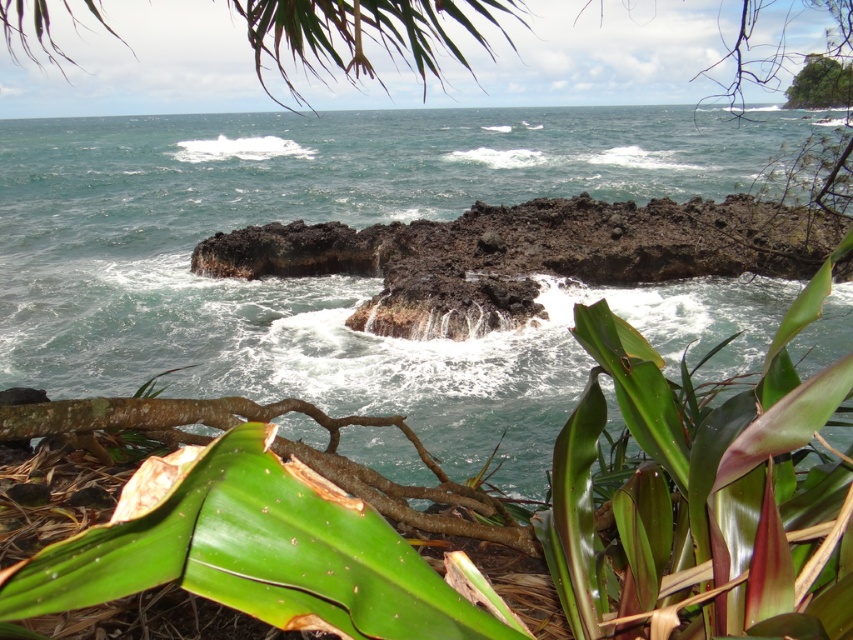
Based on the coordinates provided, what is the color of the area at point (351, 276) in the image?

The area at point (351, 276) is greenish blue water at center.